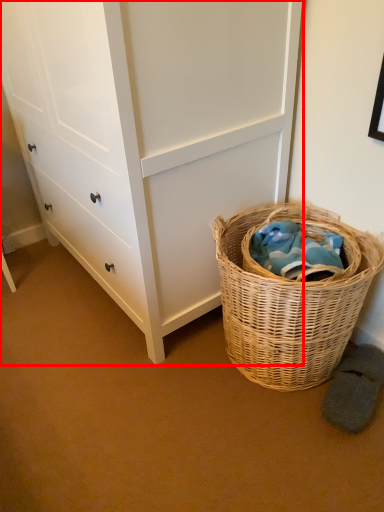
Question: In this image, where is chest of drawers (annotated by the red box) located relative to picnic basket?

Choices:
 (A) left
 (B) right

Answer: (A)